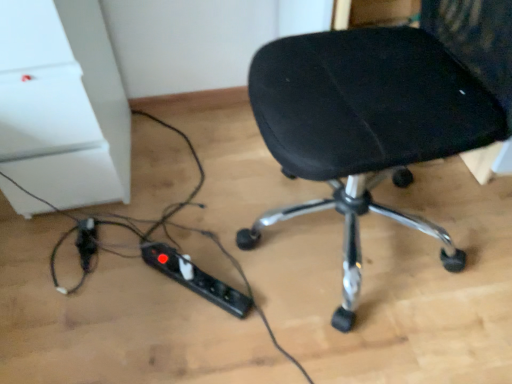
Describe the element at coordinates (382, 113) in the screenshot. I see `black fabric chair at center` at that location.

At what (x,y) coordinates should I click in order to perform the action: click on black plastic extension cord at lower center, the second extension cord when ordered from left to right. Please return your answer as a coordinate pair (x, y). The image size is (512, 384). Looking at the image, I should click on (195, 278).

This screenshot has height=384, width=512. Identify the location of black plastic extension cord at lower left, which appears as the 2th extension cord when viewed from the right. (86, 242).

I want to click on black fabric chair at center, so click(382, 113).

Would you say black fabric chair at center is outside black plastic extension cord at lower center, acting as the 1th extension cord starting from the right?

Absolutely, black fabric chair at center is external to black plastic extension cord at lower center, acting as the 1th extension cord starting from the right.

Which object is wider, black fabric chair at center or black plastic extension cord at lower center, the second extension cord when ordered from left to right?

black fabric chair at center.

Based on the photo, from the image's perspective, does black fabric chair at center appear higher than black plastic extension cord at lower center, the second extension cord when ordered from left to right?

Correct, black fabric chair at center appears higher than black plastic extension cord at lower center, the second extension cord when ordered from left to right, in the image.

Is black fabric chair at center touching black plastic extension cord at lower center, acting as the 1th extension cord starting from the right?

No, black fabric chair at center is not with black plastic extension cord at lower center, acting as the 1th extension cord starting from the right.

This screenshot has height=384, width=512. I want to click on extension cord located on the right of black plastic extension cord at lower left, which appears as the 2th extension cord when viewed from the right, so point(195,278).

Does point (96, 232) come farther from viewer compared to point (190, 276)?

Yes, point (96, 232) is farther from viewer.

Considering the sizes of black plastic extension cord at lower left, which appears as the first extension cord when viewed from the left, and black plastic extension cord at lower center, the second extension cord when ordered from left to right, in the image, is black plastic extension cord at lower left, which appears as the first extension cord when viewed from the left, wider or thinner than black plastic extension cord at lower center, the second extension cord when ordered from left to right,?

In the image, black plastic extension cord at lower left, which appears as the first extension cord when viewed from the left, appears to be more narrow than black plastic extension cord at lower center, the second extension cord when ordered from left to right.

Is black plastic extension cord at lower center, the second extension cord when ordered from left to right, with black fabric chair at center?

No.

Consider the image. Between black plastic extension cord at lower center, the second extension cord when ordered from left to right, and black fabric chair at center, which one has larger size?

With larger size is black fabric chair at center.

From the image's perspective, is black plastic extension cord at lower center, the second extension cord when ordered from left to right, located above black fabric chair at center?

No.

Which object is more forward, black plastic extension cord at lower center, the second extension cord when ordered from left to right, or black fabric chair at center?

black fabric chair at center is closer to the camera.

From the image's perspective, is black plastic extension cord at lower left, which appears as the 2th extension cord when viewed from the right, located above or below black fabric chair at center?

black plastic extension cord at lower left, which appears as the 2th extension cord when viewed from the right, is situated lower than black fabric chair at center in the image.

Do you think black plastic extension cord at lower left, which appears as the first extension cord when viewed from the left, is within black fabric chair at center, or outside of it?

black plastic extension cord at lower left, which appears as the first extension cord when viewed from the left, exists outside the volume of black fabric chair at center.

Between black plastic extension cord at lower left, which appears as the first extension cord when viewed from the left, and black fabric chair at center, which one has less height?

With less height is black plastic extension cord at lower left, which appears as the first extension cord when viewed from the left.

From a real-world perspective, which is physically above, black plastic extension cord at lower left, which appears as the first extension cord when viewed from the left, or black fabric chair at center?

black fabric chair at center, from a real-world perspective.

Between black fabric chair at center and black plastic extension cord at lower left, which appears as the 2th extension cord when viewed from the right, which one has smaller width?

black plastic extension cord at lower left, which appears as the 2th extension cord when viewed from the right.

Can you confirm if black fabric chair at center is bigger than black plastic extension cord at lower left, which appears as the 2th extension cord when viewed from the right?

Yes, black fabric chair at center is bigger than black plastic extension cord at lower left, which appears as the 2th extension cord when viewed from the right.

Do you think black fabric chair at center is within black plastic extension cord at lower left, which appears as the 2th extension cord when viewed from the right, or outside of it?

black fabric chair at center is located beyond the bounds of black plastic extension cord at lower left, which appears as the 2th extension cord when viewed from the right.

Consider the image. Are black plastic extension cord at lower center, the second extension cord when ordered from left to right, and black plastic extension cord at lower left, which appears as the first extension cord when viewed from the left, far apart?

No, black plastic extension cord at lower center, the second extension cord when ordered from left to right, is not far from black plastic extension cord at lower left, which appears as the first extension cord when viewed from the left.

Is black plastic extension cord at lower center, acting as the 1th extension cord starting from the right, looking in the opposite direction of black plastic extension cord at lower left, which appears as the first extension cord when viewed from the left?

That's right, black plastic extension cord at lower center, acting as the 1th extension cord starting from the right, is facing away from black plastic extension cord at lower left, which appears as the first extension cord when viewed from the left.

Which object is thinner, black plastic extension cord at lower center, the second extension cord when ordered from left to right, or black plastic extension cord at lower left, which appears as the first extension cord when viewed from the left?

black plastic extension cord at lower left, which appears as the first extension cord when viewed from the left, is thinner.

Is black plastic extension cord at lower center, the second extension cord when ordered from left to right, positioned in front of black plastic extension cord at lower left, which appears as the 2th extension cord when viewed from the right?

Yes, black plastic extension cord at lower center, the second extension cord when ordered from left to right, is closer to the camera.

Find the location of a particular element. chair that is above the black plastic extension cord at lower center, the second extension cord when ordered from left to right (from the image's perspective) is located at coordinates (382, 113).

In the image, there is a black plastic extension cord at lower center, the second extension cord when ordered from left to right. Where is `extension cord below it (from a real-world perspective)`? This screenshot has height=384, width=512. extension cord below it (from a real-world perspective) is located at coordinates (86, 242).

Estimate the real-world distances between objects in this image. Which object is closer to black plastic extension cord at lower center, the second extension cord when ordered from left to right, black plastic extension cord at lower left, which appears as the first extension cord when viewed from the left, or black fabric chair at center?

black plastic extension cord at lower left, which appears as the first extension cord when viewed from the left.

Estimate the real-world distances between objects in this image. Which object is closer to black plastic extension cord at lower left, which appears as the first extension cord when viewed from the left, black plastic extension cord at lower center, acting as the 1th extension cord starting from the right, or black fabric chair at center?

The object closer to black plastic extension cord at lower left, which appears as the first extension cord when viewed from the left, is black plastic extension cord at lower center, acting as the 1th extension cord starting from the right.

Based on their spatial positions, is black fabric chair at center or black plastic extension cord at lower left, which appears as the first extension cord when viewed from the left, further from black plastic extension cord at lower center, acting as the 1th extension cord starting from the right?

black fabric chair at center is positioned further to the anchor black plastic extension cord at lower center, acting as the 1th extension cord starting from the right.

Which object lies nearer to the anchor point black fabric chair at center, black plastic extension cord at lower center, acting as the 1th extension cord starting from the right, or black plastic extension cord at lower left, which appears as the first extension cord when viewed from the left?

black plastic extension cord at lower center, acting as the 1th extension cord starting from the right, is closer to black fabric chair at center.

Estimate the real-world distances between objects in this image. Which object is closer to black fabric chair at center, black plastic extension cord at lower left, which appears as the 2th extension cord when viewed from the right, or black plastic extension cord at lower center, acting as the 1th extension cord starting from the right?

black plastic extension cord at lower center, acting as the 1th extension cord starting from the right, is positioned closer to the anchor black fabric chair at center.

Looking at the image, which one is located further to black plastic extension cord at lower left, which appears as the 2th extension cord when viewed from the right, black fabric chair at center or black plastic extension cord at lower center, the second extension cord when ordered from left to right?

black fabric chair at center is further to black plastic extension cord at lower left, which appears as the 2th extension cord when viewed from the right.

Locate an element on the screen. extension cord between black fabric chair at center and black plastic extension cord at lower left, which appears as the first extension cord when viewed from the left, along the z-axis is located at coordinates (195, 278).